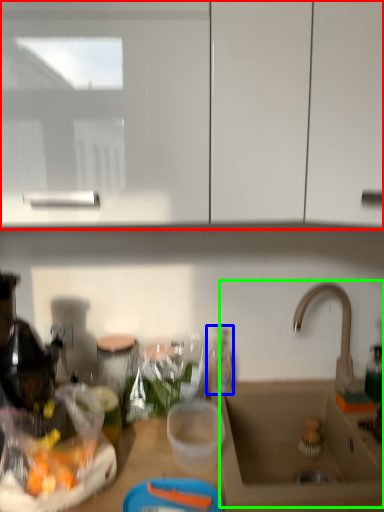
Question: Based on their relative distances, which object is nearer to cabinetry (highlighted by a red box)? Choose from bottle (highlighted by a blue box) and sink (highlighted by a green box).

Choices:
 (A) bottle
 (B) sink

Answer: (B)